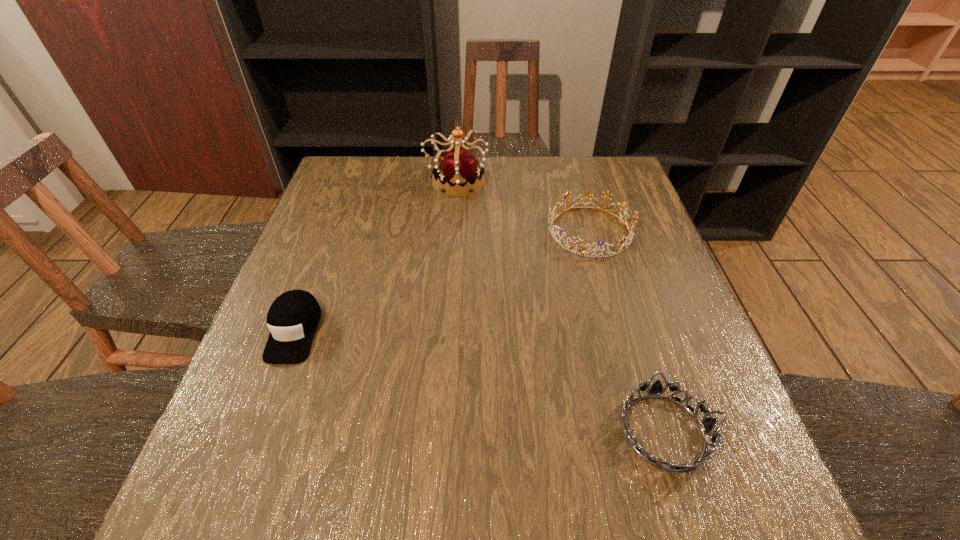
Where is `vacant space located on the front-facing side of the second farthest tiara`? vacant space located on the front-facing side of the second farthest tiara is located at coordinates (509, 231).

This screenshot has height=540, width=960. In order to click on free space located on the front-facing side of the second farthest tiara in this screenshot , I will do `click(402, 231)`.

Image resolution: width=960 pixels, height=540 pixels. I want to click on vacant space located on the front-facing side of the third farthest object, so click(x=252, y=444).

The height and width of the screenshot is (540, 960). What are the coordinates of `free space located 0.380m on the front-facing side of the nearest object` in the screenshot? It's located at (397, 431).

Locate an element on the screen. The width and height of the screenshot is (960, 540). vacant space located 0.320m on the front-facing side of the nearest object is located at coordinates (432, 431).

Where is `vacant point located 0.250m on the front-facing side of the nearest object`? The height and width of the screenshot is (540, 960). vacant point located 0.250m on the front-facing side of the nearest object is located at coordinates (471, 431).

You are a GUI agent. You are given a task and a screenshot of the screen. Output one action in this format:
    pyautogui.click(x=<x>, y=<y>)
    Task: Click on the object at the far edge
    The image size is (960, 540).
    Given the screenshot: What is the action you would take?
    pyautogui.click(x=459, y=169)

Locate an element on the screen. The height and width of the screenshot is (540, 960). object at the near edge is located at coordinates (706, 425).

The width and height of the screenshot is (960, 540). Identify the location of object located at the left edge. (293, 318).

The width and height of the screenshot is (960, 540). I want to click on object at the near right corner, so click(706, 425).